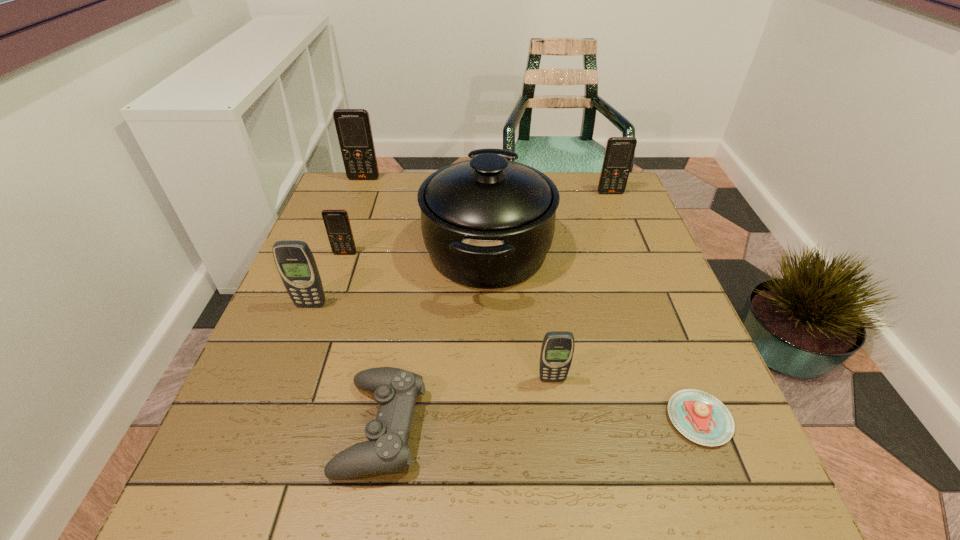
I want to click on vacant space positioned 0.340m on the back of the control, so click(x=410, y=263).

At what (x,y) coordinates should I click in order to perform the action: click on free spot located on the left of the shortest object. Please return your answer as a coordinate pair (x, y). This screenshot has height=540, width=960. Looking at the image, I should click on (601, 419).

Locate an element on the screen. The image size is (960, 540). saucepan at the far edge is located at coordinates (488, 223).

You are a GUI agent. You are given a task and a screenshot of the screen. Output one action in this format:
    pyautogui.click(x=<x>, y=<y>)
    Task: Click on the object present at the near edge
    This screenshot has width=960, height=540.
    Given the screenshot: What is the action you would take?
    pyautogui.click(x=395, y=390)

This screenshot has height=540, width=960. In order to click on cellular telephone at the right edge in this screenshot , I will do `click(619, 152)`.

The width and height of the screenshot is (960, 540). In order to click on pastry positioned at the right edge in this screenshot , I will do (x=702, y=418).

You are a GUI agent. You are given a task and a screenshot of the screen. Output one action in this format:
    pyautogui.click(x=<x>, y=<y>)
    Task: Click on the object that is at the far left corner
    The width and height of the screenshot is (960, 540).
    Given the screenshot: What is the action you would take?
    pyautogui.click(x=353, y=126)

The height and width of the screenshot is (540, 960). I want to click on object present at the far right corner, so click(x=619, y=152).

This screenshot has height=540, width=960. In the image, there is a desktop. What are the coordinates of `free space at the far edge` in the screenshot? It's located at (430, 175).

This screenshot has width=960, height=540. In the image, there is a desktop. What are the coordinates of `vacant space at the near edge` in the screenshot? It's located at (537, 502).